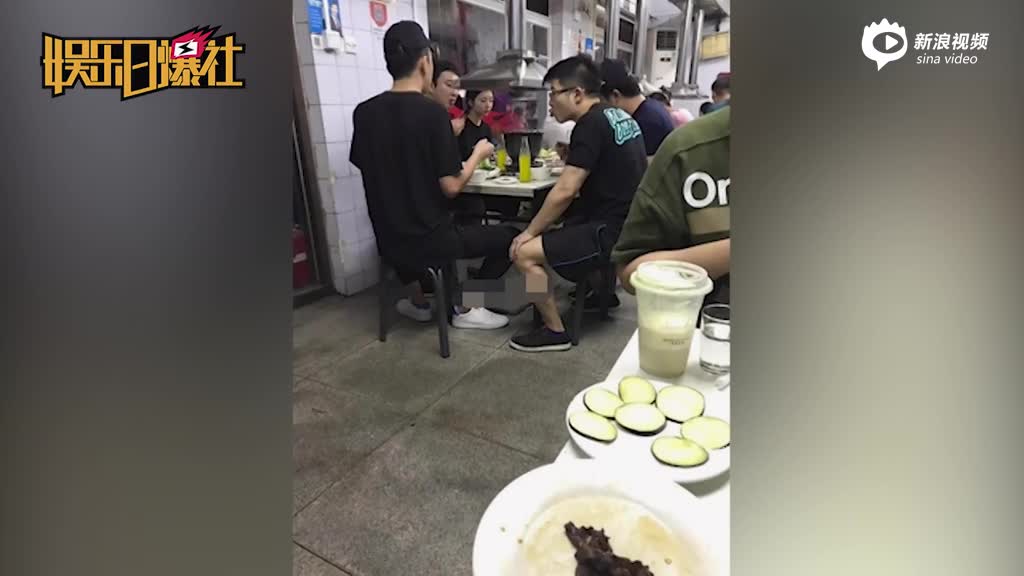
Locate an element on the screen. This screenshot has width=1024, height=576. floor is located at coordinates click(x=411, y=397).